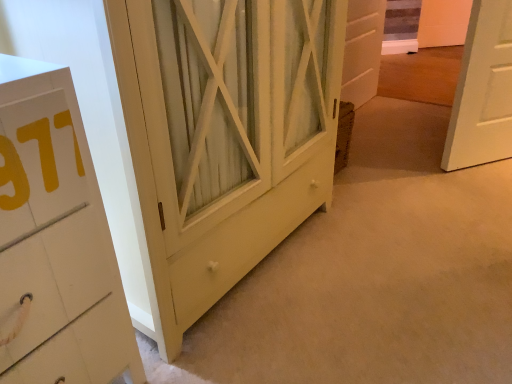
Question: Is there a large distance between white wood door at center and matte yellow cabinet at center?

Choices:
 (A) no
 (B) yes

Answer: (B)

Question: Is white wood door at center completely or partially outside of matte yellow cabinet at center?

Choices:
 (A) yes
 (B) no

Answer: (A)

Question: Can you confirm if white wood door at center is smaller than matte yellow cabinet at center?

Choices:
 (A) no
 (B) yes

Answer: (B)

Question: Is matte yellow cabinet at center located within white wood door at center?

Choices:
 (A) no
 (B) yes

Answer: (A)

Question: Is white wood door at center at the right side of matte yellow cabinet at center?

Choices:
 (A) no
 (B) yes

Answer: (B)

Question: Does white wood door at center have a greater height compared to matte yellow cabinet at center?

Choices:
 (A) no
 (B) yes

Answer: (A)

Question: From a real-world perspective, is matte yellow cabinet at center on white wood door at center?

Choices:
 (A) yes
 (B) no

Answer: (A)

Question: Can you confirm if matte yellow cabinet at center is taller than white wood door at center?

Choices:
 (A) no
 (B) yes

Answer: (B)

Question: Considering the relative positions of matte yellow cabinet at center and white wood door at center in the image provided, is matte yellow cabinet at center to the right of white wood door at center from the viewer's perspective?

Choices:
 (A) no
 (B) yes

Answer: (A)

Question: Considering the relative sizes of matte yellow cabinet at center and white wood door at center in the image provided, is matte yellow cabinet at center wider than white wood door at center?

Choices:
 (A) yes
 (B) no

Answer: (A)

Question: Is matte yellow cabinet at center positioned beyond the bounds of white wood door at center?

Choices:
 (A) no
 (B) yes

Answer: (B)

Question: Is matte yellow cabinet at center smaller than white wood door at center?

Choices:
 (A) no
 (B) yes

Answer: (A)

Question: From the image's perspective, is matte yellow cabinet at center positioned above or below white wood door at center?

Choices:
 (A) below
 (B) above

Answer: (A)